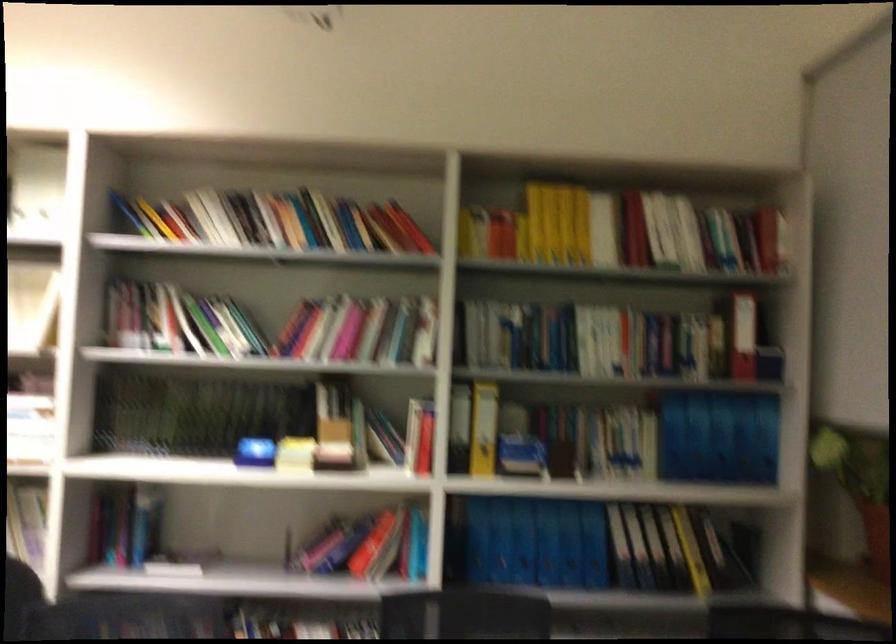
Find where to pull the red binder. Please return your answer as a coordinate pair (x, y).

(744, 337)